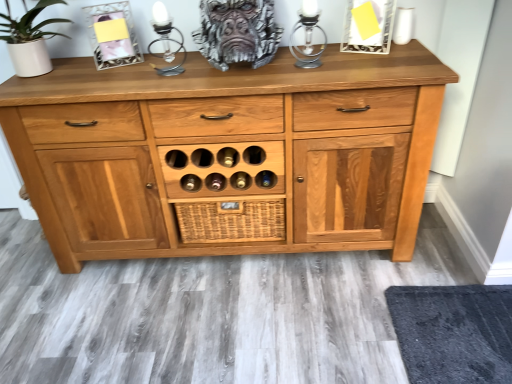
Question: Does silver metallic candle holder at upper center, the second candle holder viewed from the left, have a greater width compared to black textured mat at lower right?

Choices:
 (A) yes
 (B) no

Answer: (B)

Question: From the image's perspective, is silver metallic candle holder at upper center, the second candle holder viewed from the left, below black textured mat at lower right?

Choices:
 (A) yes
 (B) no

Answer: (B)

Question: Considering the relative positions of silver metallic candle holder at upper center, the first candle holder viewed from the right, and black textured mat at lower right in the image provided, is silver metallic candle holder at upper center, the first candle holder viewed from the right, to the left of black textured mat at lower right from the viewer's perspective?

Choices:
 (A) yes
 (B) no

Answer: (A)

Question: From the image's perspective, is silver metallic candle holder at upper center, the first candle holder viewed from the right, on black textured mat at lower right?

Choices:
 (A) no
 (B) yes

Answer: (B)

Question: From a real-world perspective, is silver metallic candle holder at upper center, the second candle holder viewed from the left, beneath black textured mat at lower right?

Choices:
 (A) no
 (B) yes

Answer: (A)

Question: Is silver metallic candle holder at upper center, the second candle holder viewed from the left, positioned with its back to black textured mat at lower right?

Choices:
 (A) no
 (B) yes

Answer: (A)

Question: Is metallic silver candle holder at upper center, which is the first candle holder in left-to-right order, behind black textured mat at lower right?

Choices:
 (A) no
 (B) yes

Answer: (B)

Question: Is metallic silver candle holder at upper center, which is the first candle holder in left-to-right order, completely or partially outside of black textured mat at lower right?

Choices:
 (A) yes
 (B) no

Answer: (A)

Question: Can you confirm if metallic silver candle holder at upper center, which is counted as the 2th candle holder, starting from the right, is taller than black textured mat at lower right?

Choices:
 (A) no
 (B) yes

Answer: (B)

Question: Does metallic silver candle holder at upper center, which is counted as the 2th candle holder, starting from the right, have a larger size compared to black textured mat at lower right?

Choices:
 (A) yes
 (B) no

Answer: (B)

Question: Are metallic silver candle holder at upper center, which is counted as the 2th candle holder, starting from the right, and black textured mat at lower right beside each other?

Choices:
 (A) no
 (B) yes

Answer: (A)

Question: Does metallic silver candle holder at upper center, which is the first candle holder in left-to-right order, have a smaller size compared to black textured mat at lower right?

Choices:
 (A) yes
 (B) no

Answer: (A)

Question: Is silver metallic candle holder at upper center, the first candle holder viewed from the right, bigger than woven brown basket at center?

Choices:
 (A) yes
 (B) no

Answer: (B)